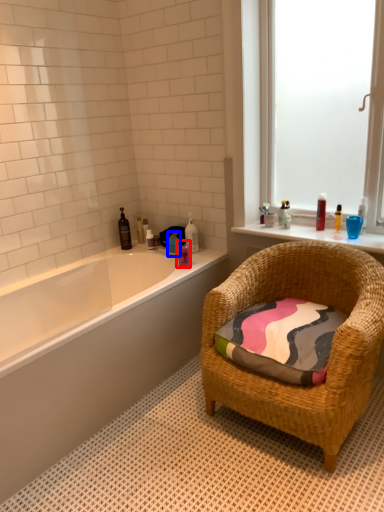
Question: Which object appears closest to the camera in this image, toiletry (highlighted by a red box) or toiletry (highlighted by a blue box)?

Choices:
 (A) toiletry
 (B) toiletry

Answer: (A)